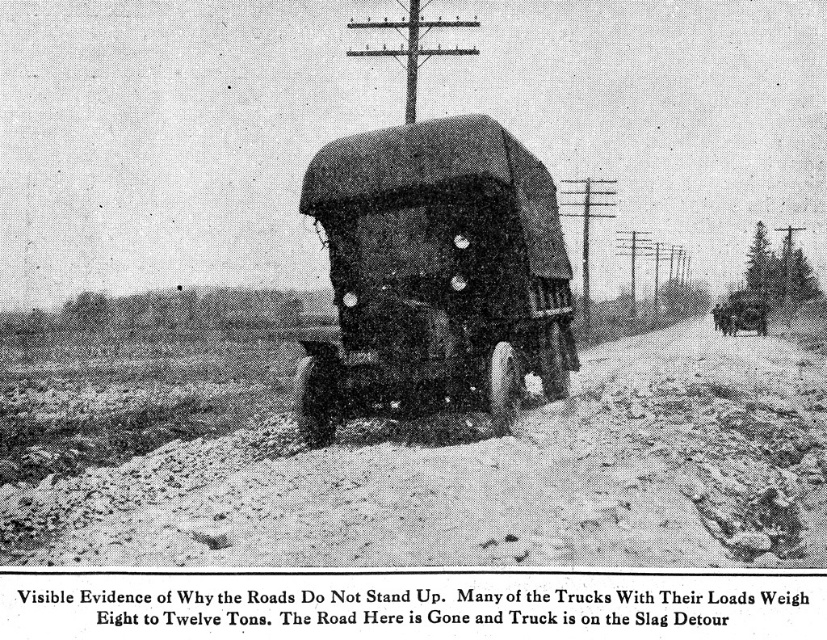
Question: Is the position of dusty gravel road at center less distant than that of dark matte truck at center?

Choices:
 (A) no
 (B) yes

Answer: (B)

Question: Is dusty gravel road at center below dark matte truck at center?

Choices:
 (A) yes
 (B) no

Answer: (A)

Question: Is dusty gravel road at center to the left of dark matte truck at center from the viewer's perspective?

Choices:
 (A) no
 (B) yes

Answer: (A)

Question: Among these objects, which one is farthest from the camera?

Choices:
 (A) dark matte truck at center
 (B) dusty gravel road at center

Answer: (A)

Question: Which point is farther to the camera?

Choices:
 (A) (565, 339)
 (B) (502, 449)

Answer: (A)